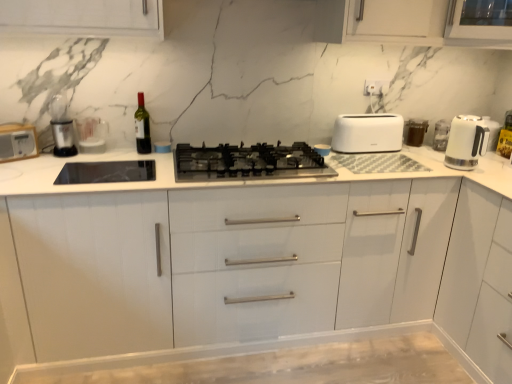
You are a GUI agent. You are given a task and a screenshot of the screen. Output one action in this format:
    pyautogui.click(x=<x>, y=<y>)
    Task: Click on the white matte toaster at right
    Image resolution: width=512 pixels, height=384 pixels.
    Given the screenshot: What is the action you would take?
    pyautogui.click(x=367, y=133)

The width and height of the screenshot is (512, 384). Identify the location of white plastic toaster at left. (17, 142).

Where is `brown matte container at upper right`? brown matte container at upper right is located at coordinates (416, 131).

Measure the distance between brown matte container at upper right and camera.

The depth of brown matte container at upper right is 7.96 feet.

Describe the element at coordinates (142, 127) in the screenshot. The width and height of the screenshot is (512, 384). I see `matte glass wine bottle at center` at that location.

Identify the location of matte glass wine bottle at center. (142, 127).

Locate an element on the screen. The width and height of the screenshot is (512, 384). white matte toaster at right is located at coordinates (367, 133).

From a real-world perspective, which is physically below, black matte gas stove at center or matte glass wine bottle at center?

black matte gas stove at center is physically lower.

Is the surface of black matte gas stove at center in direct contact with matte glass wine bottle at center?

No, black matte gas stove at center is not next to matte glass wine bottle at center.

Can you confirm if black matte gas stove at center is smaller than matte glass wine bottle at center?

Incorrect, black matte gas stove at center is not smaller in size than matte glass wine bottle at center.

Would you say black matte gas stove at center is to the left or to the right of matte glass wine bottle at center in the picture?

Based on their positions, black matte gas stove at center is located to the right of matte glass wine bottle at center.

I want to click on toaster on the left of matte glass wine bottle at center, so click(x=17, y=142).

Would you say matte glass wine bottle at center is outside white plastic toaster at left?

Indeed, matte glass wine bottle at center is completely outside white plastic toaster at left.

From a real-world perspective, between matte glass wine bottle at center and white plastic toaster at left, who is vertically lower?

white plastic toaster at left.

Considering the sizes of objects matte glass wine bottle at center and white plastic toaster at left in the image provided, who is bigger, matte glass wine bottle at center or white plastic toaster at left?

matte glass wine bottle at center.

Considering the sizes of objects white glossy electric kettle at right and white matte toaster at right in the image provided, who is smaller, white glossy electric kettle at right or white matte toaster at right?

Smaller between the two is white glossy electric kettle at right.

From a real-world perspective, between white glossy electric kettle at right and white matte toaster at right, who is vertically lower?

white matte toaster at right.

Is white glossy electric kettle at right not close to white matte toaster at right?

They are positioned close to each other.

Which of these two, white plastic toaster at left or white matte toaster at right, is thinner?

white plastic toaster at left is thinner.

From the image's perspective, is white plastic toaster at left positioned above or below white matte toaster at right?

white plastic toaster at left is below white matte toaster at right.

Can you confirm if white plastic toaster at left is smaller than white matte toaster at right?

Yes.

From a real-world perspective, which is physically below, white plastic toaster at left or white matte toaster at right?

white plastic toaster at left, from a real-world perspective.

Looking at this image, from the image's perspective, between matte glass wine bottle at center and white matte cabinet at right, who is located below?

white matte cabinet at right.

Can you confirm if matte glass wine bottle at center is positioned to the right of white matte cabinet at right?

Incorrect, matte glass wine bottle at center is not on the right side of white matte cabinet at right.

How much distance is there between matte glass wine bottle at center and white matte cabinet at right?

matte glass wine bottle at center and white matte cabinet at right are 5.58 feet apart from each other.

Is white matte cabinet at right with brown matte container at upper right?

There is a gap between white matte cabinet at right and brown matte container at upper right.

Is white matte cabinet at right positioned with its back to brown matte container at upper right?

No, brown matte container at upper right is not at the back of white matte cabinet at right.

From the image's perspective, is white matte cabinet at right beneath brown matte container at upper right?

Yes, from the image's perspective, white matte cabinet at right is beneath brown matte container at upper right.

Between white glossy electric kettle at right and matte glass wine bottle at center, which one has smaller size?

matte glass wine bottle at center is smaller.

What are the coordinates of `home appliance located on the right of matte glass wine bottle at center` in the screenshot? It's located at (466, 142).

Is matte glass wine bottle at center a part of white glossy electric kettle at right?

No, matte glass wine bottle at center is not inside white glossy electric kettle at right.

From the image's perspective, who appears lower, white glossy electric kettle at right or matte glass wine bottle at center?

white glossy electric kettle at right, from the image's perspective.

What are the coordinates of `wine bottle lying on the left of black matte gas stove at center` in the screenshot? It's located at (142, 127).

Identify the location of toaster in front of the matte glass wine bottle at center. The image size is (512, 384). point(17,142).

Looking at the image, which one is located further to white plastic toaster at left, brown matte container at upper right or matte glass wine bottle at center?

brown matte container at upper right is further to white plastic toaster at left.

Which object lies further to the anchor point white plastic toaster at left, matte glass wine bottle at center or white glossy electric kettle at right?

white glossy electric kettle at right is positioned further to the anchor white plastic toaster at left.

In the scene shown: Looking at the image, which one is located further to white glossy electric kettle at right, black matte gas stove at center or white plastic toaster at left?

white plastic toaster at left is positioned further to the anchor white glossy electric kettle at right.

Consider the image. Estimate the real-world distances between objects in this image. Which object is closer to brown matte container at upper right, black matte gas stove at center or white matte cabinet at right?

white matte cabinet at right is closer to brown matte container at upper right.

Considering their positions, is white matte cabinet at right positioned further to matte glass wine bottle at center than brown matte container at upper right?

white matte cabinet at right is further to matte glass wine bottle at center.

From the image, which object appears to be nearer to white matte toaster at right, matte glass wine bottle at center or brown matte container at upper right?

The object closer to white matte toaster at right is brown matte container at upper right.

Which object lies nearer to the anchor point white matte cabinet at right, white glossy electric kettle at right or black matte gas stove at center?

white glossy electric kettle at right is positioned closer to the anchor white matte cabinet at right.

Looking at the image, which one is located further to brown matte container at upper right, matte glass wine bottle at center or white plastic toaster at left?

Among the two, white plastic toaster at left is located further to brown matte container at upper right.

What are the coordinates of `kitchen appliance located between white plastic toaster at left and brown matte container at upper right in the left-right direction` in the screenshot? It's located at (367, 133).

Where is `appliance located between matte glass wine bottle at center and white glossy electric kettle at right in the left-right direction`? This screenshot has height=384, width=512. appliance located between matte glass wine bottle at center and white glossy electric kettle at right in the left-right direction is located at coordinates (416, 131).

This screenshot has height=384, width=512. Find the location of `home appliance between matte glass wine bottle at center and white matte cabinet at right from left to right`. home appliance between matte glass wine bottle at center and white matte cabinet at right from left to right is located at coordinates (466, 142).

Where is `kitchen appliance between white matte cabinet at right and brown matte container at upper right in the front-back direction`? The width and height of the screenshot is (512, 384). kitchen appliance between white matte cabinet at right and brown matte container at upper right in the front-back direction is located at coordinates (367, 133).